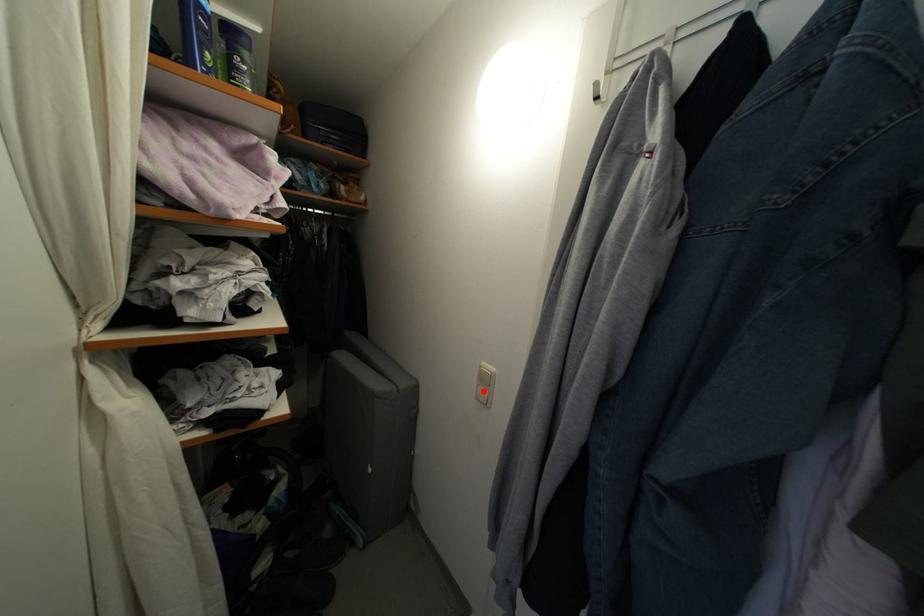
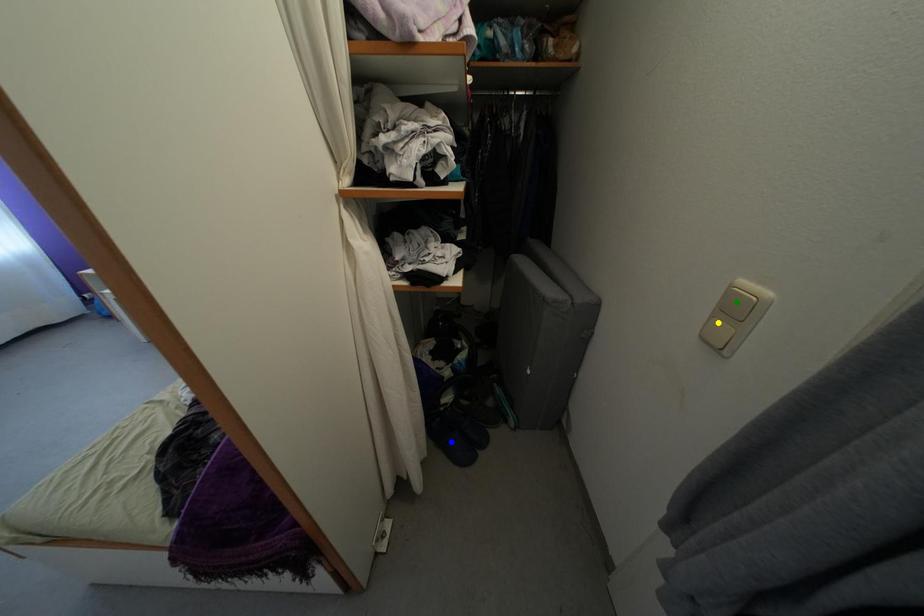
Question: I am providing you with two images of the same scene from different viewpoints. A red point is marked on the first image. You are given multiple points on the second image. Which spot in image 2 lines up with the point in image 1?

Choices:
 (A) green point
 (B) yellow point
 (C) blue point

Answer: (B)